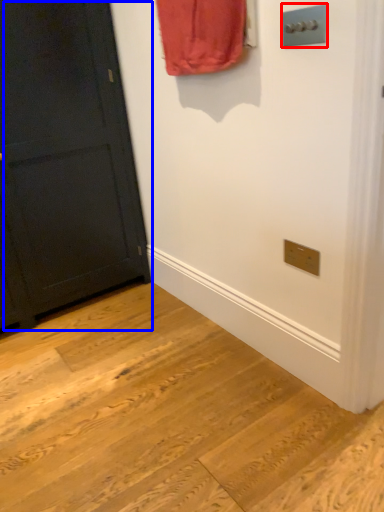
Question: Which object is further to the camera taking this photo, light switch (highlighted by a red box) or door (highlighted by a blue box)?

Choices:
 (A) light switch
 (B) door

Answer: (B)